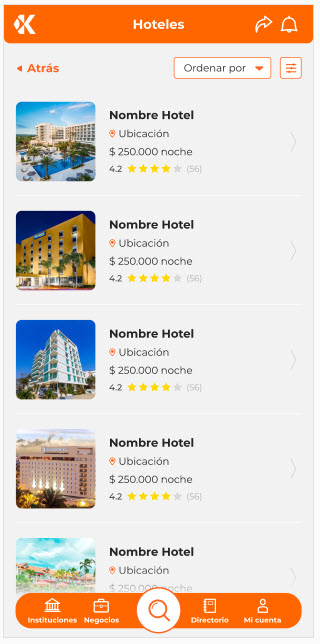
Where is `window`? The height and width of the screenshot is (644, 320). window is located at coordinates (55, 375).